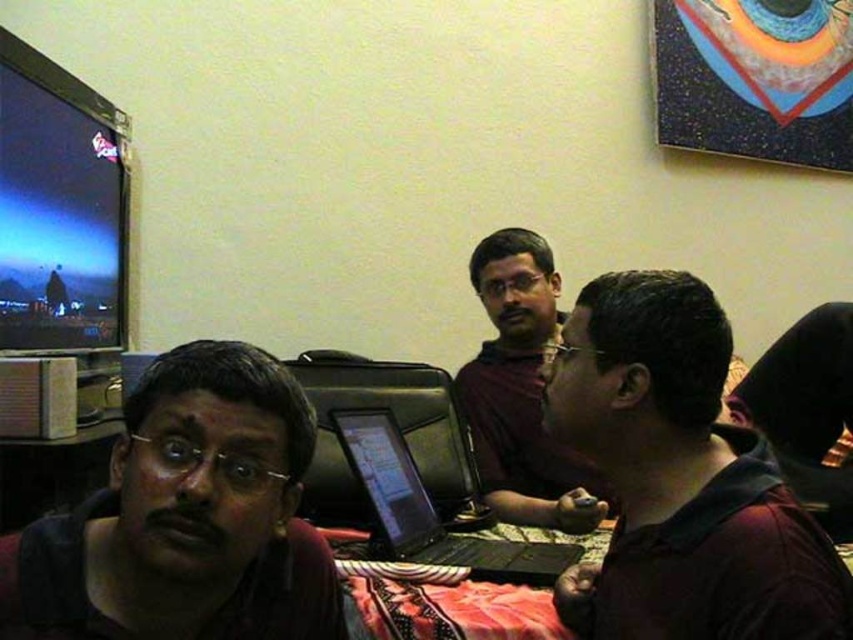
Question: Which object is closer to the camera taking this photo?

Choices:
 (A) matte brown shirt at center
 (B) black glossy laptop at center
 (C) dark brown hair at center
 (D) shiny black monitor at upper left

Answer: (C)

Question: Which point is closer to the camera?

Choices:
 (A) matte brown shirt at center
 (B) shiny black monitor at upper left

Answer: (A)

Question: Can you confirm if matte black shirt at left is thinner than black glossy laptop at center?

Choices:
 (A) no
 (B) yes

Answer: (B)

Question: Can you confirm if shiny black monitor at upper left is positioned below matte brown shirt at center?

Choices:
 (A) no
 (B) yes

Answer: (A)

Question: Among these objects, which one is nearest to the camera?

Choices:
 (A) matte black shirt at left
 (B) shiny black monitor at upper left

Answer: (A)

Question: Observing the image, what is the correct spatial positioning of matte brown shirt at center in reference to black glossy laptop at center?

Choices:
 (A) below
 (B) above

Answer: (B)